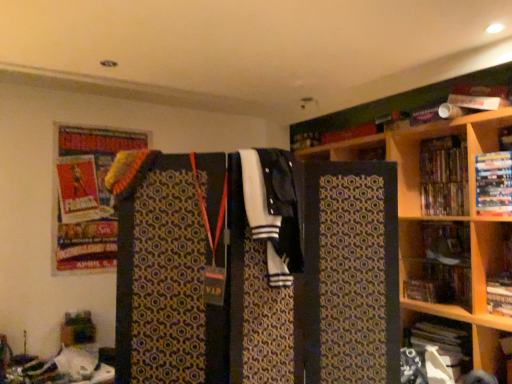
Question: Are white paper at lower right, placed as the fourth book when sorted from top to bottom, and wooden bookshelf at right located far from each other?

Choices:
 (A) yes
 (B) no

Answer: (B)

Question: Can you confirm if white paper at lower right, placed as the fourth book when sorted from top to bottom, is thinner than wooden bookshelf at right?

Choices:
 (A) yes
 (B) no

Answer: (B)

Question: Considering the relative sizes of white paper at lower right, placed as the fourth book when sorted from top to bottom, and wooden bookshelf at right in the image provided, is white paper at lower right, placed as the fourth book when sorted from top to bottom, wider than wooden bookshelf at right?

Choices:
 (A) no
 (B) yes

Answer: (B)

Question: Is white paper at lower right, placed as the fourth book when sorted from top to bottom, located outside wooden bookshelf at right?

Choices:
 (A) yes
 (B) no

Answer: (A)

Question: From the image's perspective, is white paper at lower right, placed as the fourth book when sorted from top to bottom, located beneath wooden bookshelf at right?

Choices:
 (A) yes
 (B) no

Answer: (A)

Question: From a real-world perspective, is white paper at lower right, placed as the 1th book when sorted from bottom to top, below wooden bookshelf at right?

Choices:
 (A) no
 (B) yes

Answer: (B)

Question: From a real-world perspective, is white and black fabric at center over white paper at lower right, placed as the 1th book when sorted from bottom to top?

Choices:
 (A) yes
 (B) no

Answer: (A)

Question: Is white paper at lower right, placed as the 1th book when sorted from bottom to top, a part of white and black fabric at center?

Choices:
 (A) yes
 (B) no

Answer: (B)

Question: Is white and black fabric at center not within white paper at lower right, placed as the fourth book when sorted from top to bottom?

Choices:
 (A) yes
 (B) no

Answer: (A)

Question: Is white and black fabric at center wider than white paper at lower right, placed as the 1th book when sorted from bottom to top?

Choices:
 (A) no
 (B) yes

Answer: (A)

Question: Considering the relative sizes of white and black fabric at center and white paper at lower right, placed as the fourth book when sorted from top to bottom, in the image provided, is white and black fabric at center shorter than white paper at lower right, placed as the fourth book when sorted from top to bottom,?

Choices:
 (A) yes
 (B) no

Answer: (B)

Question: Is white and black fabric at center next to white paper at lower right, placed as the fourth book when sorted from top to bottom?

Choices:
 (A) yes
 (B) no

Answer: (B)

Question: Is hardcover book at upper right, the third book positioned from the bottom, far from wooden bookshelf at right?

Choices:
 (A) no
 (B) yes

Answer: (A)